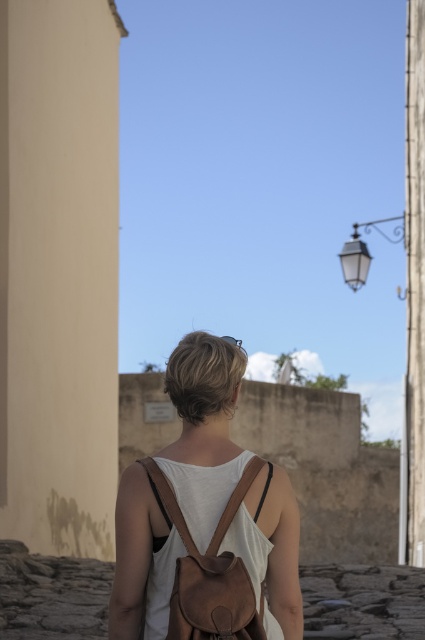
Question: Does brown leather backpack at center come behind leather backpack at back?

Choices:
 (A) no
 (B) yes

Answer: (B)

Question: Is brown leather backpack at center closer to the viewer compared to leather backpack at back?

Choices:
 (A) yes
 (B) no

Answer: (B)

Question: Is brown leather backpack at center wider than leather backpack at back?

Choices:
 (A) yes
 (B) no

Answer: (A)

Question: Which of the following is the closest to the observer?

Choices:
 (A) brown leather backpack at center
 (B) leather backpack at back

Answer: (B)

Question: Among these objects, which one is nearest to the camera?

Choices:
 (A) leather backpack at back
 (B) brown leather backpack at center

Answer: (A)